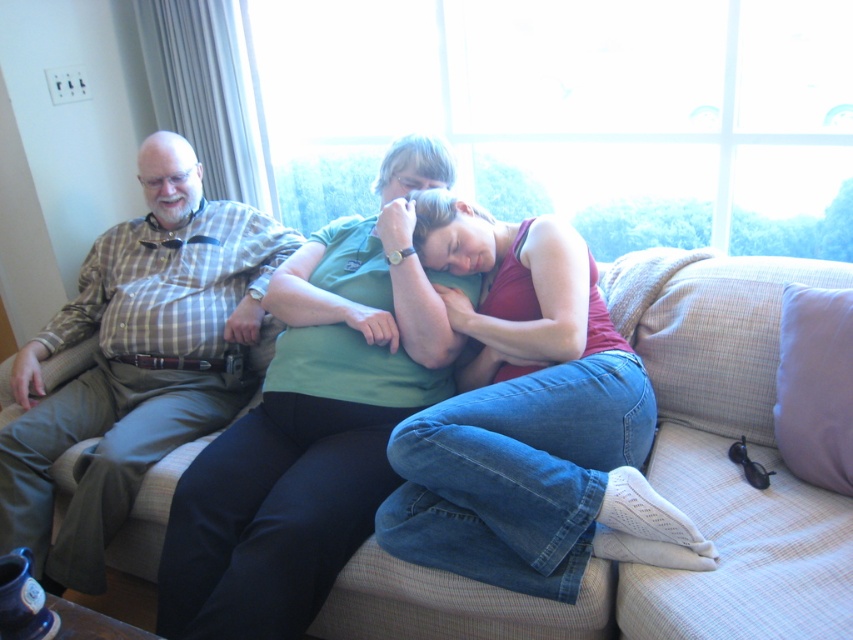
You are a guest in this living room and want to take a photo through the transparent glass window at upper center while also including the plaid shirt at left in the frame. Is the window positioned in a way that allows both elements to be captured in the same photo?

The transparent glass window at upper center is positioned over the plaid shirt at left, so yes, the window is above the plaid shirt at left. This means the plaid shirt at left is likely within the same frame as the window when taking a photo through it.

You are sitting on the beige fabric couch at center and want to reach the purple fabric pillow at right. Considering their positions, can you easily grab the pillow without moving from your seat?

The beige fabric couch at center is closer to the viewer than the purple fabric pillow at right, so the pillow is farther away. Therefore, you might need to stretch or move slightly to reach it.

You are standing in the living room and want to hand a gift to the person wearing the matte green shirt at center. Which direction should you walk to reach them?

The matte green shirt at center is located at point (x=311, y=424), so you should walk towards the center of the living room to reach the person wearing the matte green shirt at center.